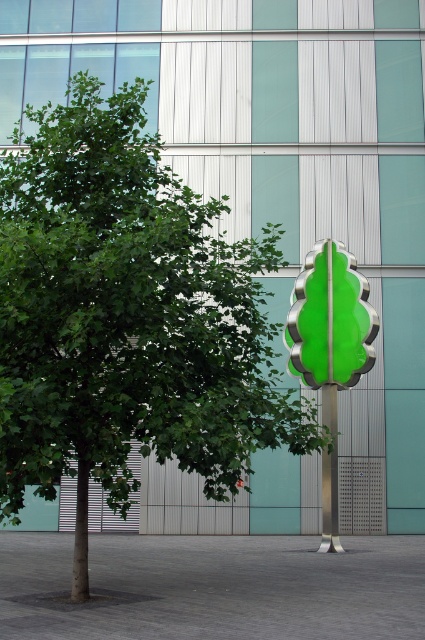
You are a city planner analyzing this urban space. You notice a point at coordinates (127,317). What object is located at this point?

The point at coordinates (127,317) corresponds to the green leafy tree at center.

You are a city planner assessing the space between the green leafy tree at center and the metallic pole at center. Which object occupies more space in the scene?

The green leafy tree at center is larger in size than the metallic pole at center, so it occupies more space in the scene.